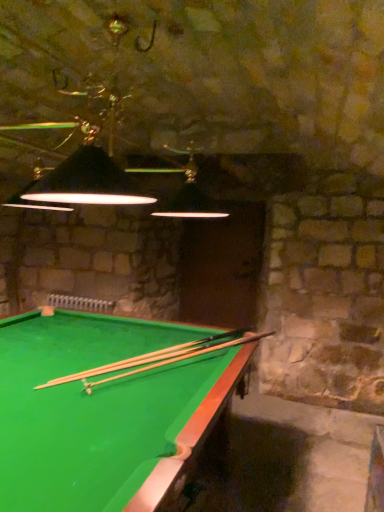
What do you see at coordinates (156, 359) in the screenshot? The height and width of the screenshot is (512, 384). I see `wooden cue at bottom` at bounding box center [156, 359].

Image resolution: width=384 pixels, height=512 pixels. I want to click on wooden cue at bottom, so click(x=156, y=359).

Identify the location of wooden cue at bottom. (156, 359).